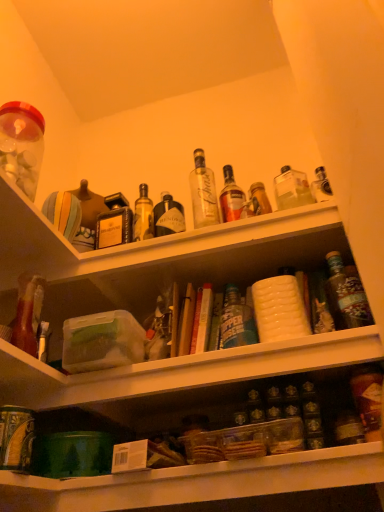
Measure the distance between white textured container at center, the second shelf positioned from the bottom, and camera.

The distance of white textured container at center, the second shelf positioned from the bottom, from camera is 91.86 centimeters.

What is the approximate height of translucent plastic jar at upper left?

12.37 inches.

How much space does translucent glass bottle at lower right, marked as the 1th bottle in a front-to-back arrangement, occupy horizontally?

The width of translucent glass bottle at lower right, marked as the 1th bottle in a front-to-back arrangement, is 6.83 centimeters.

Locate an element on the screen. The height and width of the screenshot is (512, 384). clear plastic container at center, arranged as the second shelf when viewed from the top is located at coordinates (196, 482).

At what (x,y) coordinates should I click in order to perform the action: click on white textured container at center, the second shelf positioned from the bottom. Please return your answer as a coordinate pair (x, y). The height and width of the screenshot is (512, 384). Looking at the image, I should click on (152, 259).

Considering the sizes of objects white textured container at center, the second shelf positioned from the bottom, and clear plastic container at center, arranged as the second shelf when viewed from the top, in the image provided, who is bigger, white textured container at center, the second shelf positioned from the bottom, or clear plastic container at center, arranged as the second shelf when viewed from the top,?

clear plastic container at center, arranged as the second shelf when viewed from the top, is bigger.

Is white textured container at center, positioned as the first shelf in top-to-bottom order, not within clear plastic container at center, positioned as the 1th shelf in bottom-to-top order?

Yes, white textured container at center, positioned as the first shelf in top-to-bottom order, is outside of clear plastic container at center, positioned as the 1th shelf in bottom-to-top order.

Is point (30, 224) closer or farther from the camera than point (257, 482)?

Clearly, point (30, 224) is more distant from the camera than point (257, 482).

What's the angular difference between white textured container at center, positioned as the first shelf in top-to-bottom order, and clear plastic container at center, arranged as the second shelf when viewed from the top,'s facing directions?

0.165 degrees.

Is translucent glass bottle at lower right, positioned as the second bottle in top-to-bottom order, touching clear plastic container at center, arranged as the second shelf when viewed from the top?

No.

Looking at the image, does translucent glass bottle at lower right, which is the second bottle in back-to-front order, seem bigger or smaller compared to clear plastic container at center, positioned as the 1th shelf in bottom-to-top order?

In the image, translucent glass bottle at lower right, which is the second bottle in back-to-front order, appears to be smaller than clear plastic container at center, positioned as the 1th shelf in bottom-to-top order.

Where is `the 1st shelf to the left of the translucent glass bottle at lower right, which is the second bottle in back-to-front order, starting your count from the anchor`? This screenshot has width=384, height=512. the 1st shelf to the left of the translucent glass bottle at lower right, which is the second bottle in back-to-front order, starting your count from the anchor is located at coordinates (196, 482).

In the scene shown: From the image's perspective, would you say translucent glass bottle at lower right, positioned as the second bottle in top-to-bottom order, is positioned over clear plastic container at center, arranged as the second shelf when viewed from the top?

Yes, from the image's perspective, translucent glass bottle at lower right, positioned as the second bottle in top-to-bottom order, is on top of clear plastic container at center, arranged as the second shelf when viewed from the top.

From the image's perspective, count 2nd bottles downward from the white textured container at center, the second shelf positioned from the bottom, and point to it. Please provide its 2D coordinates.

[(368, 400)]

Would you say translucent glass bottle at lower right, which is the second bottle in back-to-front order, is outside white textured container at center, positioned as the first shelf in top-to-bottom order?

Yes, translucent glass bottle at lower right, which is the second bottle in back-to-front order, is located beyond the bounds of white textured container at center, positioned as the first shelf in top-to-bottom order.

From a real-world perspective, which object stands above the other?

white textured container at center, the second shelf positioned from the bottom, is physically above.

Which object is wider, translucent glass bottle at lower right, positioned as the second bottle in top-to-bottom order, or white textured container at center, the second shelf positioned from the bottom?

With larger width is white textured container at center, the second shelf positioned from the bottom.

Could you tell me if clear plastic container at center, positioned as the 1th shelf in bottom-to-top order, is facing translucent glass bottle at lower right, marked as the 1th bottle in a front-to-back arrangement?

No, clear plastic container at center, positioned as the 1th shelf in bottom-to-top order, is not aimed at translucent glass bottle at lower right, marked as the 1th bottle in a front-to-back arrangement.

Is clear plastic container at center, positioned as the 1th shelf in bottom-to-top order, completely or partially outside of translucent glass bottle at lower right, marked as the 1th bottle in a front-to-back arrangement?

clear plastic container at center, positioned as the 1th shelf in bottom-to-top order, lies outside translucent glass bottle at lower right, marked as the 1th bottle in a front-to-back arrangement,'s area.

Considering the sizes of objects clear plastic container at center, arranged as the second shelf when viewed from the top, and translucent glass bottle at lower right, marked as the 1th bottle in a front-to-back arrangement, in the image provided, who is bigger, clear plastic container at center, arranged as the second shelf when viewed from the top, or translucent glass bottle at lower right, marked as the 1th bottle in a front-to-back arrangement,?

With larger size is clear plastic container at center, arranged as the second shelf when viewed from the top.

From the image's perspective, would you say clear plastic container at center, positioned as the 1th shelf in bottom-to-top order, is shown under translucent glass bottle at lower right, marked as the 1th bottle in a front-to-back arrangement?

Indeed, from the image's perspective, clear plastic container at center, positioned as the 1th shelf in bottom-to-top order, is shown beneath translucent glass bottle at lower right, marked as the 1th bottle in a front-to-back arrangement.

Looking at this image, can you tell me how much clear plastic container at center, arranged as the second shelf when viewed from the top, and white textured container at center, the second shelf positioned from the bottom, differ in facing direction?

0.165 degrees separate the facing orientations of clear plastic container at center, arranged as the second shelf when viewed from the top, and white textured container at center, the second shelf positioned from the bottom.

In the image, is clear plastic container at center, arranged as the second shelf when viewed from the top, positioned in front of or behind white textured container at center, positioned as the first shelf in top-to-bottom order?

clear plastic container at center, arranged as the second shelf when viewed from the top, is in front of white textured container at center, positioned as the first shelf in top-to-bottom order.

Is white textured container at center, positioned as the first shelf in top-to-bottom order, at the back of clear plastic container at center, positioned as the 1th shelf in bottom-to-top order?

No.

Between clear plastic container at center, positioned as the 1th shelf in bottom-to-top order, and white textured container at center, positioned as the first shelf in top-to-bottom order, which one has more height?

Standing taller between the two is clear plastic container at center, positioned as the 1th shelf in bottom-to-top order.

Identify the location of beverage in front of the shiny dark brown bottle at right, the first bottle viewed from the top. (22, 145).

Does translucent plastic jar at upper left touch shiny dark brown bottle at right, arranged as the second bottle when viewed from the front?

translucent plastic jar at upper left and shiny dark brown bottle at right, arranged as the second bottle when viewed from the front, are clearly separated.

Does translucent plastic jar at upper left have a smaller size compared to shiny dark brown bottle at right, acting as the 2th bottle starting from the bottom?

A: Incorrect, translucent plastic jar at upper left is not smaller in size than shiny dark brown bottle at right, acting as the 2th bottle starting from the bottom.

Between point (13, 103) and point (355, 297), which one is positioned behind?

The point (13, 103) is more distant.

Is translucent plastic jar at upper left oriented towards translucent glass bottle at lower right, which is counted as the 1th bottle, starting from the bottom?

No, translucent plastic jar at upper left is not facing towards translucent glass bottle at lower right, which is counted as the 1th bottle, starting from the bottom.

Is translucent plastic jar at upper left not inside translucent glass bottle at lower right, positioned as the second bottle in top-to-bottom order?

Yes.

From the translucent plastic jar at upper left, count 1st bottle to the right and point to it. Please provide its 2D coordinates.

[(368, 400)]

Is translucent plastic jar at upper left shorter than translucent glass bottle at lower right, marked as the 1th bottle in a front-to-back arrangement?

In fact, translucent plastic jar at upper left may be taller than translucent glass bottle at lower right, marked as the 1th bottle in a front-to-back arrangement.

Locate an element on the screen. The width and height of the screenshot is (384, 512). shelf located on the left of clear plastic container at center, positioned as the 1th shelf in bottom-to-top order is located at coordinates (152, 259).

Where is `the 1st shelf above the translucent glass bottle at lower right, which is the second bottle in back-to-front order (from a real-world perspective)`? Image resolution: width=384 pixels, height=512 pixels. the 1st shelf above the translucent glass bottle at lower right, which is the second bottle in back-to-front order (from a real-world perspective) is located at coordinates (196, 482).

When comparing their distances from white textured container at center, positioned as the first shelf in top-to-bottom order, does translucent glass bottle at lower right, which is the second bottle in back-to-front order, or clear plastic container at center, positioned as the 1th shelf in bottom-to-top order, seem closer?

The object closer to white textured container at center, positioned as the first shelf in top-to-bottom order, is clear plastic container at center, positioned as the 1th shelf in bottom-to-top order.

Which object lies further to the anchor point clear plastic container at center, arranged as the second shelf when viewed from the top, translucent plastic jar at upper left or white textured container at center, the second shelf positioned from the bottom?

translucent plastic jar at upper left is positioned further to the anchor clear plastic container at center, arranged as the second shelf when viewed from the top.

Based on their spatial positions, is translucent plastic jar at upper left or translucent glass bottle at lower right, which is the second bottle in back-to-front order, further from shiny dark brown bottle at right, which ranks as the first bottle in back-to-front order?

Among the two, translucent plastic jar at upper left is located further to shiny dark brown bottle at right, which ranks as the first bottle in back-to-front order.

Consider the image. Based on their spatial positions, is translucent plastic jar at upper left or shiny dark brown bottle at right, acting as the 2th bottle starting from the bottom, further from clear plastic container at center, arranged as the second shelf when viewed from the top?

translucent plastic jar at upper left is positioned further to the anchor clear plastic container at center, arranged as the second shelf when viewed from the top.

Looking at the image, which one is located further to translucent plastic jar at upper left, shiny dark brown bottle at right, which ranks as the first bottle in back-to-front order, or clear plastic container at center, positioned as the 1th shelf in bottom-to-top order?

The object further to translucent plastic jar at upper left is shiny dark brown bottle at right, which ranks as the first bottle in back-to-front order.

Which object lies nearer to the anchor point clear plastic container at center, arranged as the second shelf when viewed from the top, shiny dark brown bottle at right, arranged as the second bottle when viewed from the front, or translucent glass bottle at lower right, positioned as the second bottle in top-to-bottom order?

Based on the image, translucent glass bottle at lower right, positioned as the second bottle in top-to-bottom order, appears to be nearer to clear plastic container at center, arranged as the second shelf when viewed from the top.

Based on their spatial positions, is translucent glass bottle at lower right, positioned as the second bottle in top-to-bottom order, or translucent plastic jar at upper left further from white textured container at center, positioned as the first shelf in top-to-bottom order?

translucent glass bottle at lower right, positioned as the second bottle in top-to-bottom order, is further to white textured container at center, positioned as the first shelf in top-to-bottom order.

When comparing their distances from translucent glass bottle at lower right, which is the second bottle in back-to-front order, does white textured container at center, the second shelf positioned from the bottom, or shiny dark brown bottle at right, acting as the 2th bottle starting from the bottom, seem further?

white textured container at center, the second shelf positioned from the bottom, is further to translucent glass bottle at lower right, which is the second bottle in back-to-front order.

Find the location of a particular element. The image size is (384, 512). bottle situated between clear plastic container at center, arranged as the second shelf when viewed from the top, and shiny dark brown bottle at right, arranged as the second bottle when viewed from the front, from left to right is located at coordinates tap(368, 400).

Identify the location of shelf between translucent plastic jar at upper left and clear plastic container at center, arranged as the second shelf when viewed from the top, vertically. click(152, 259).

You are a GUI agent. You are given a task and a screenshot of the screen. Output one action in this format:
    pyautogui.click(x=<x>, y=<y>)
    Task: Click on the bottle located between white textured container at center, positioned as the first shelf in top-to-bottom order, and shiny dark brown bottle at right, the first bottle viewed from the top, in the left-right direction
    Image resolution: width=384 pixels, height=512 pixels.
    Given the screenshot: What is the action you would take?
    pyautogui.click(x=368, y=400)

You are a GUI agent. You are given a task and a screenshot of the screen. Output one action in this format:
    pyautogui.click(x=<x>, y=<y>)
    Task: Click on the bottle situated between translucent plastic jar at upper left and shiny dark brown bottle at right, arranged as the second bottle when viewed from the front, from left to right
    
    Given the screenshot: What is the action you would take?
    pyautogui.click(x=368, y=400)